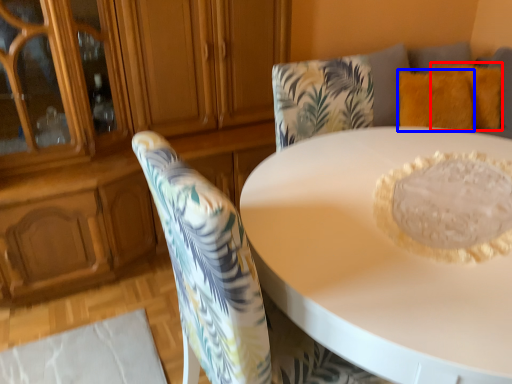
Question: Which of the following is the closest to the observer, pillow (highlighted by a red box) or pillow (highlighted by a blue box)?

Choices:
 (A) pillow
 (B) pillow

Answer: (B)